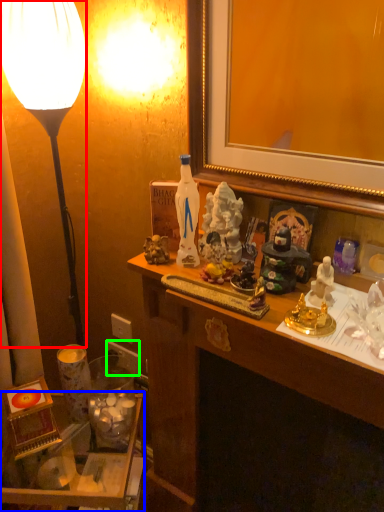
Question: Which object is the closest to the lamp (highlighted by a red box)? Choose among these: table (highlighted by a blue box) or power outlet (highlighted by a green box).

Choices:
 (A) table
 (B) power outlet

Answer: (B)